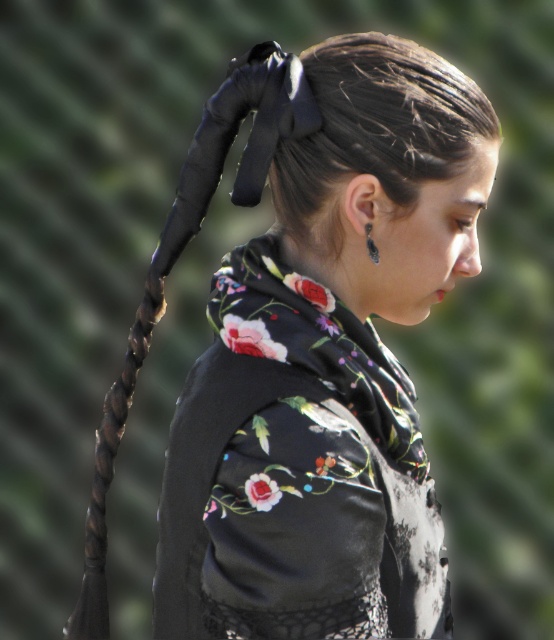
You are a photographer adjusting your camera settings to capture the details of the black satin bow at center and the silver metallic earring at ear. Which object should you focus on first if you want to ensure both are in sharp focus, considering their positions?

The black satin bow at center is above the silver metallic earring at ear, so you should focus on the black satin bow at center first to ensure both are in sharp focus as it is closer to the camera.

You are a photographer adjusting the lighting for a portrait. You need to ensure that both the black glossy hair braid at left and the silver metallic earring at ear are well lit. Based on their positions, which object should you focus the light on first to ensure proper illumination?

The black glossy hair braid at left is positioned on the left side of the silver metallic earring at ear. Since the braid is on the left, you should focus the light on the silver metallic earring at ear first to ensure it is properly illuminated before adjusting for the braid.